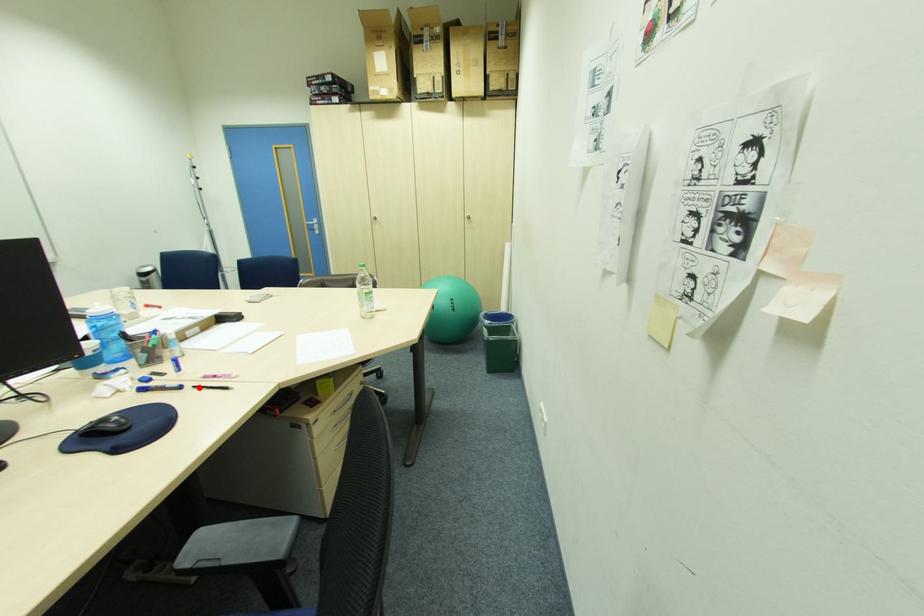
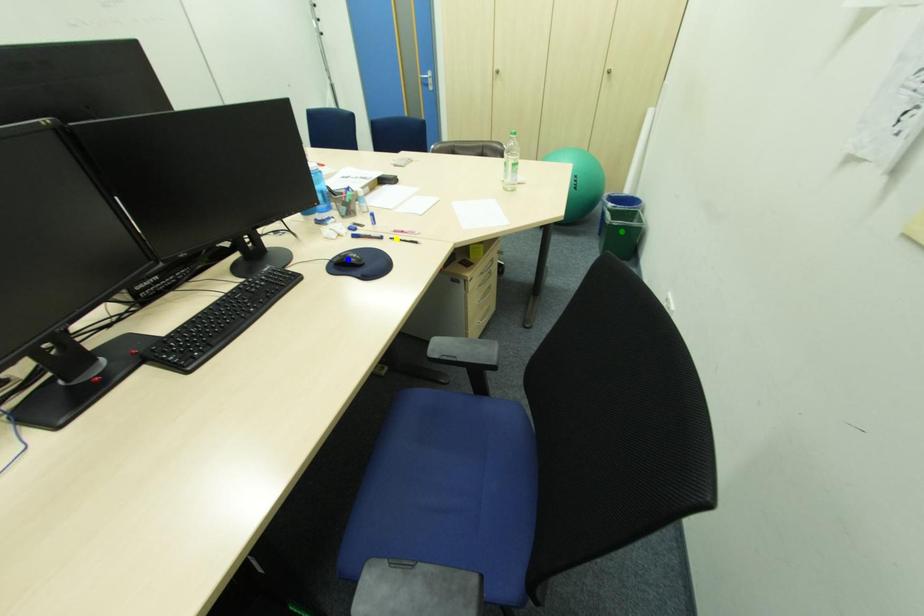
Question: I am providing you with two images of the same scene from different viewpoints. A red point is marked on the first image. You are given multiple points on the second image. Which point in image 2 is actually the same real-world point as the red point in image 1?

Choices:
 (A) green point
 (B) yellow point
 (C) blue point

Answer: (B)